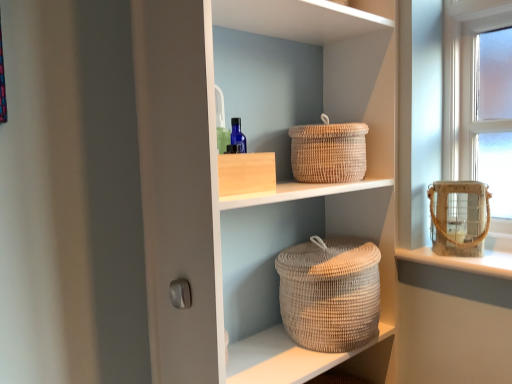
What is the approximate height of natural woven basket at upper center?

8.46 inches.

What is the approximate width of neutral woven basket at center, positioned as the second basket container in top-to-bottom order?

It is 12.07 inches.

Describe the element at coordinates (330, 293) in the screenshot. I see `neutral woven basket at center, which is counted as the 2th basket container, starting from the right` at that location.

This screenshot has height=384, width=512. What do you see at coordinates (180, 293) in the screenshot?
I see `white glossy door handle at lower left` at bounding box center [180, 293].

The height and width of the screenshot is (384, 512). Describe the element at coordinates (252, 193) in the screenshot. I see `natural woven basket at center` at that location.

In the scene shown: In order to face natural woven basket at center, should I rotate leftwards or rightwards?

A 4.140 degree turn to the right will do.

Locate an element on the screen. This screenshot has height=384, width=512. rustic woven basket at right, the 2th basket container when ordered from bottom to top is located at coordinates (459, 217).

Find the location of `basket located on the left of rustic woven basket at right, which is counted as the 1th basket container, starting from the right`. basket located on the left of rustic woven basket at right, which is counted as the 1th basket container, starting from the right is located at coordinates (328, 152).

From the image's perspective, is rustic woven basket at right, which is counted as the 1th basket container, starting from the right, located above natural woven basket at upper center?

No, from the image's perspective, rustic woven basket at right, which is counted as the 1th basket container, starting from the right, is not over natural woven basket at upper center.

Is rustic woven basket at right, which is counted as the first basket container, starting from the top, wider or thinner than natural woven basket at upper center?

Considering their sizes, rustic woven basket at right, which is counted as the first basket container, starting from the top, looks slimmer than natural woven basket at upper center.

Which of these two, neutral woven basket at center, marked as the 1th basket container in a bottom-to-top arrangement, or white glossy door handle at lower left, stands taller?

With more height is neutral woven basket at center, marked as the 1th basket container in a bottom-to-top arrangement.

Is neutral woven basket at center, which is counted as the 2th basket container, starting from the right, positioned with its back to white glossy door handle at lower left?

No, neutral woven basket at center, which is counted as the 2th basket container, starting from the right,'s orientation is not away from white glossy door handle at lower left.

Is neutral woven basket at center, marked as the 1th basket container in a bottom-to-top arrangement, not close to white glossy door handle at lower left?

They are positioned close to each other.

Looking at the image, does neutral woven basket at center, which is counted as the 2th basket container, starting from the right, seem bigger or smaller compared to white glossy door handle at lower left?

Clearly, neutral woven basket at center, which is counted as the 2th basket container, starting from the right, is larger in size than white glossy door handle at lower left.

Which object is thinner, neutral woven basket at center, which is counted as the 2th basket container, starting from the right, or natural woven basket at center?

With smaller width is neutral woven basket at center, which is counted as the 2th basket container, starting from the right.

Does point (309, 287) lie in front of point (237, 322)?

That is True.

Considering the relative positions of neutral woven basket at center, which is the first basket container from left to right, and natural woven basket at center in the image provided, is neutral woven basket at center, which is the first basket container from left to right, to the right of natural woven basket at center from the viewer's perspective?

Yes.

Is white glossy door handle at lower left bigger than natural woven basket at center?

No, white glossy door handle at lower left is not bigger than natural woven basket at center.

Based on the photo, from the image's perspective, is white glossy door handle at lower left on top of natural woven basket at center?

No, from the image's perspective, white glossy door handle at lower left is not above natural woven basket at center.

From a real-world perspective, which object rests below the other?

white glossy door handle at lower left.

Considering the relative sizes of natural woven basket at upper center and neutral woven basket at center, marked as the 1th basket container in a bottom-to-top arrangement, in the image provided, is natural woven basket at upper center shorter than neutral woven basket at center, marked as the 1th basket container in a bottom-to-top arrangement,?

Correct, natural woven basket at upper center is not as tall as neutral woven basket at center, marked as the 1th basket container in a bottom-to-top arrangement.

Which of these two, natural woven basket at upper center or neutral woven basket at center, which is the first basket container from left to right, is thinner?

natural woven basket at upper center.

From a real-world perspective, which is physically above, natural woven basket at upper center or neutral woven basket at center, which is counted as the 2th basket container, starting from the right?

natural woven basket at upper center.

Is neutral woven basket at center, which is the first basket container from left to right, at the back of natural woven basket at upper center?

No.

Considering the sizes of objects natural woven basket at upper center and white glossy door handle at lower left in the image provided, who is wider, natural woven basket at upper center or white glossy door handle at lower left?

With larger width is natural woven basket at upper center.

The height and width of the screenshot is (384, 512). I want to click on basket that appears above the white glossy door handle at lower left (from the image's perspective), so click(328, 152).

Is natural woven basket at upper center looking in the opposite direction of white glossy door handle at lower left?

No, natural woven basket at upper center's orientation is not away from white glossy door handle at lower left.

Is point (339, 150) closer or farther from the camera than point (170, 287)?

Point (339, 150) appears to be farther away from the viewer than point (170, 287).

Which is behind, point (222, 217) or point (432, 190)?

The point (432, 190) is farther.

At what (x,y) coordinates should I click in order to perform the action: click on shelf above the rustic woven basket at right, positioned as the second basket container in left-to-right order (from a real-world perspective). Please return your answer as a coordinate pair (x, y). This screenshot has width=512, height=384. Looking at the image, I should click on tap(252, 193).

From the picture: Between natural woven basket at center and rustic woven basket at right, positioned as the second basket container in left-to-right order, which one has smaller size?

rustic woven basket at right, positioned as the second basket container in left-to-right order, is smaller.

From a real-world perspective, which object rests below the other?

From a 3D spatial view, rustic woven basket at right, which is counted as the 1th basket container, starting from the right, is below.

Where is `basket that appears on the left of rustic woven basket at right, the 2th basket container when ordered from bottom to top`? This screenshot has width=512, height=384. basket that appears on the left of rustic woven basket at right, the 2th basket container when ordered from bottom to top is located at coordinates (328, 152).

In order to click on door handle that is in front of the neutral woven basket at center, which is the first basket container from left to right in this screenshot , I will do `click(180, 293)`.

Based on their spatial positions, is natural woven basket at upper center or natural woven basket at center further from white glossy door handle at lower left?

natural woven basket at upper center lies further to white glossy door handle at lower left than the other object.

Which object lies nearer to the anchor point natural woven basket at upper center, rustic woven basket at right, positioned as the second basket container in left-to-right order, or natural woven basket at center?

Among the two, natural woven basket at center is located nearer to natural woven basket at upper center.

From the picture: Estimate the real-world distances between objects in this image. Which object is closer to white glossy door handle at lower left, neutral woven basket at center, positioned as the second basket container in top-to-bottom order, or natural woven basket at center?

neutral woven basket at center, positioned as the second basket container in top-to-bottom order, lies closer to white glossy door handle at lower left than the other object.

From the picture: Considering their positions, is white glossy door handle at lower left positioned closer to natural woven basket at center than natural woven basket at upper center?

natural woven basket at upper center lies closer to natural woven basket at center than the other object.

Consider the image. Looking at the image, which one is located further to neutral woven basket at center, marked as the 1th basket container in a bottom-to-top arrangement, natural woven basket at upper center or white glossy door handle at lower left?

white glossy door handle at lower left is positioned further to the anchor neutral woven basket at center, marked as the 1th basket container in a bottom-to-top arrangement.

Looking at the image, which one is located closer to rustic woven basket at right, the 2th basket container when ordered from bottom to top, neutral woven basket at center, positioned as the second basket container in top-to-bottom order, or natural woven basket at center?

neutral woven basket at center, positioned as the second basket container in top-to-bottom order, is positioned closer to the anchor rustic woven basket at right, the 2th basket container when ordered from bottom to top.

Which object lies nearer to the anchor point natural woven basket at upper center, white glossy door handle at lower left or neutral woven basket at center, marked as the 1th basket container in a bottom-to-top arrangement?

Based on the image, neutral woven basket at center, marked as the 1th basket container in a bottom-to-top arrangement, appears to be nearer to natural woven basket at upper center.

Which object lies nearer to the anchor point white glossy door handle at lower left, rustic woven basket at right, the 2th basket container when ordered from bottom to top, or natural woven basket at upper center?

natural woven basket at upper center is positioned closer to the anchor white glossy door handle at lower left.

You are a GUI agent. You are given a task and a screenshot of the screen. Output one action in this format:
    pyautogui.click(x=<x>, y=<y>)
    Task: Click on the basket situated between natural woven basket at center and rustic woven basket at right, positioned as the second basket container in left-to-right order, from left to right
    The width and height of the screenshot is (512, 384).
    Given the screenshot: What is the action you would take?
    pyautogui.click(x=328, y=152)

Image resolution: width=512 pixels, height=384 pixels. What are the coordinates of `basket container located between white glossy door handle at lower left and rustic woven basket at right, the 2th basket container when ordered from bottom to top, in the left-right direction` in the screenshot? It's located at (330, 293).

Where is `shelf between white glossy door handle at lower left and neutral woven basket at center, positioned as the second basket container in top-to-bottom order, from left to right`? The width and height of the screenshot is (512, 384). shelf between white glossy door handle at lower left and neutral woven basket at center, positioned as the second basket container in top-to-bottom order, from left to right is located at coordinates (252, 193).

Identify the location of shelf between white glossy door handle at lower left and natural woven basket at upper center from left to right. (252, 193).